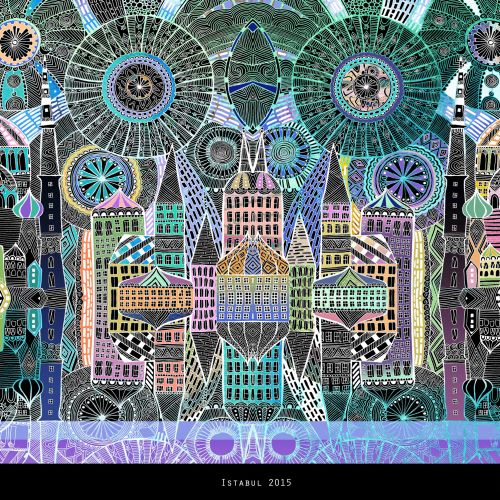
Identify the location of windows. pos(52,282), pos(50,263).